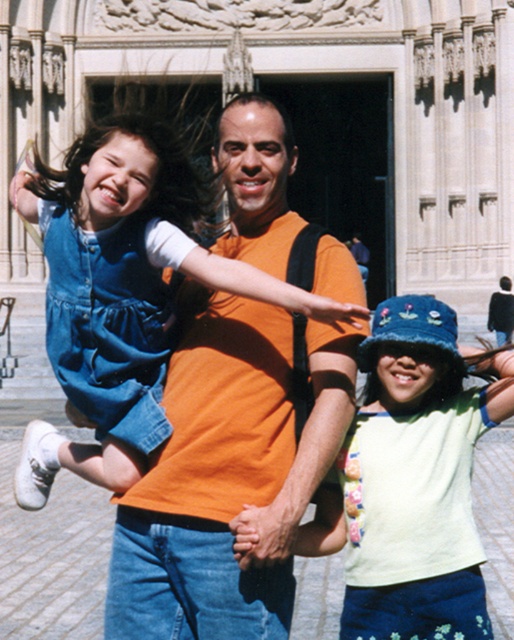
Is point (474, 627) more distant than point (151, 240)?

No, (474, 627) is closer to viewer.

Does light green fabric shirt at center have a larger size compared to denim dress at left?

No.

Is point (435, 586) less distant than point (54, 353)?

Yes, point (435, 586) is in front of point (54, 353).

You are a GUI agent. You are given a task and a screenshot of the screen. Output one action in this format:
    pyautogui.click(x=<x>, y=<y>)
    Task: Click on the light green fabric shirt at center
    Image resolution: width=514 pixels, height=640 pixels.
    Given the screenshot: What is the action you would take?
    pyautogui.click(x=411, y=477)